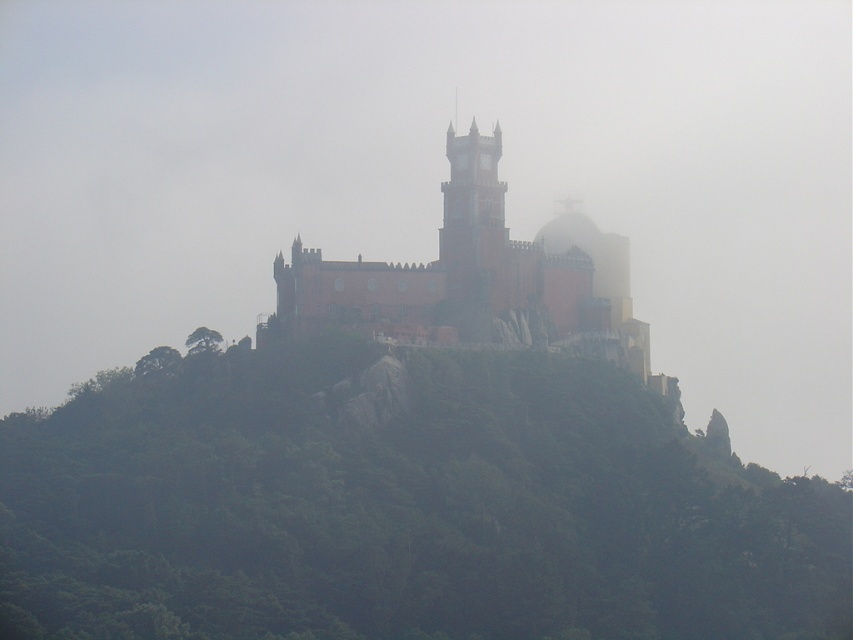
Question: Which object is closer to the camera taking this photo?

Choices:
 (A) matte pink stone castle at center
 (B) matte pink stone tower at center

Answer: (A)

Question: Can you confirm if green leafy hillside at center is positioned above matte pink stone tower at center?

Choices:
 (A) no
 (B) yes

Answer: (A)

Question: Is green leafy hillside at center to the right of matte pink stone tower at center from the viewer's perspective?

Choices:
 (A) no
 (B) yes

Answer: (B)

Question: Is matte pink stone castle at center above matte pink stone tower at center?

Choices:
 (A) no
 (B) yes

Answer: (A)

Question: Which object is positioned closest to the matte pink stone tower at center?

Choices:
 (A) matte pink stone castle at center
 (B) green leafy hillside at center

Answer: (A)

Question: Which is nearer to the green leafy hillside at center?

Choices:
 (A) matte pink stone castle at center
 (B) matte pink stone tower at center

Answer: (A)